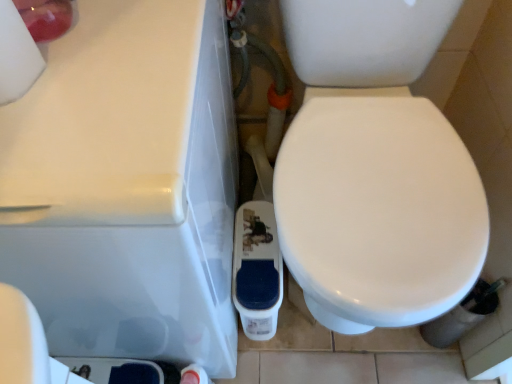
Question: From a real-world perspective, relative to white glossy porcelain at center, is white matte toilet paper at upper left vertically above or below?

Choices:
 (A) below
 (B) above

Answer: (B)

Question: Is white matte toilet paper at upper left in front of or behind white glossy porcelain at center in the image?

Choices:
 (A) behind
 (B) front

Answer: (B)

Question: Which object is positioned farthest from the white glossy bidet at center?

Choices:
 (A) white glossy porcelain at center
 (B) white matte toilet paper at upper left

Answer: (B)

Question: Which of these objects is positioned closest to the white matte toilet paper at upper left?

Choices:
 (A) white glossy bidet at center
 (B) white glossy porcelain at center

Answer: (B)